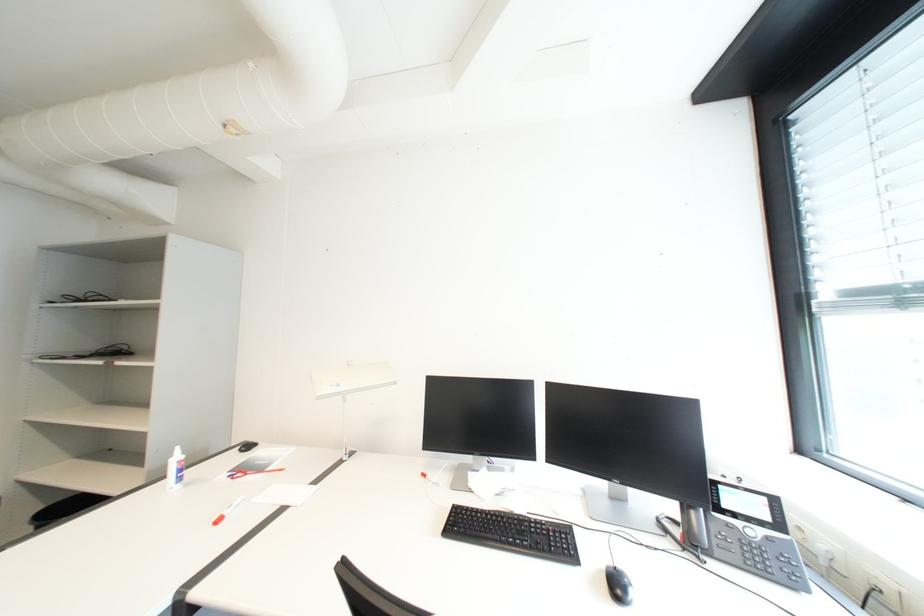
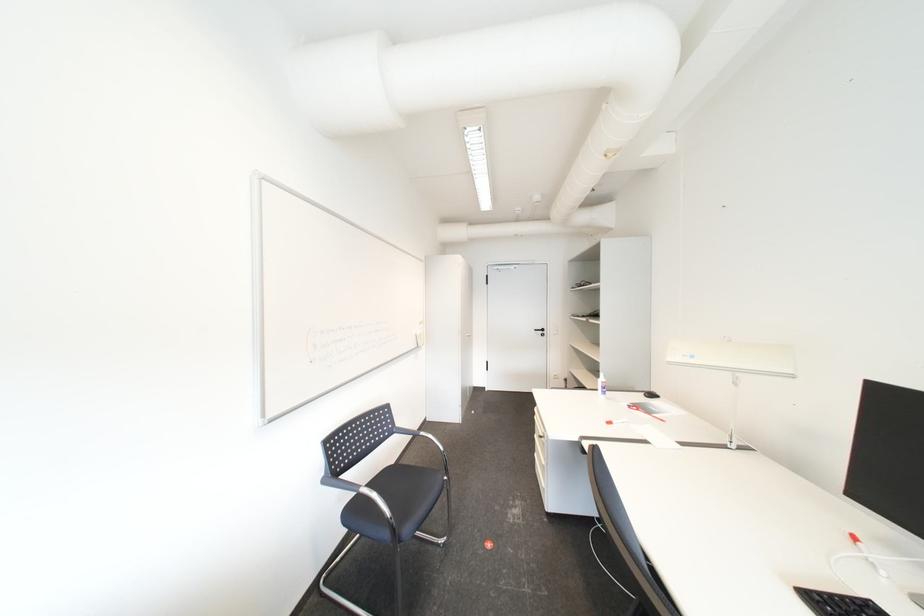
Question: How did the camera likely rotate?

Choices:
 (A) Left
 (B) Right
 (C) Up
 (D) Down

Answer: (A)